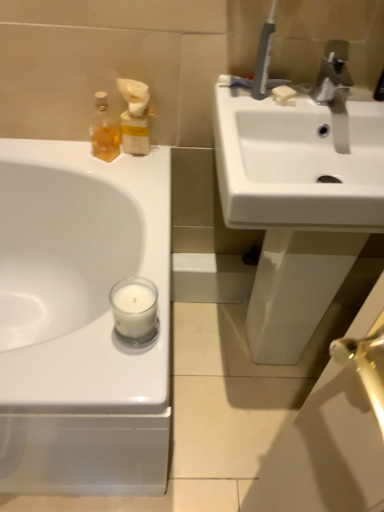
The image size is (384, 512). I want to click on vacant space to the right of silver metallic faucet at upper right, so click(366, 101).